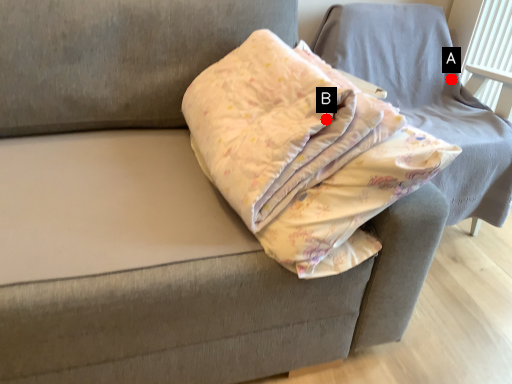
Question: Two points are circled on the image, labeled by A and B beside each circle. Which point is further to the camera?

Choices:
 (A) A is further
 (B) B is further

Answer: (A)